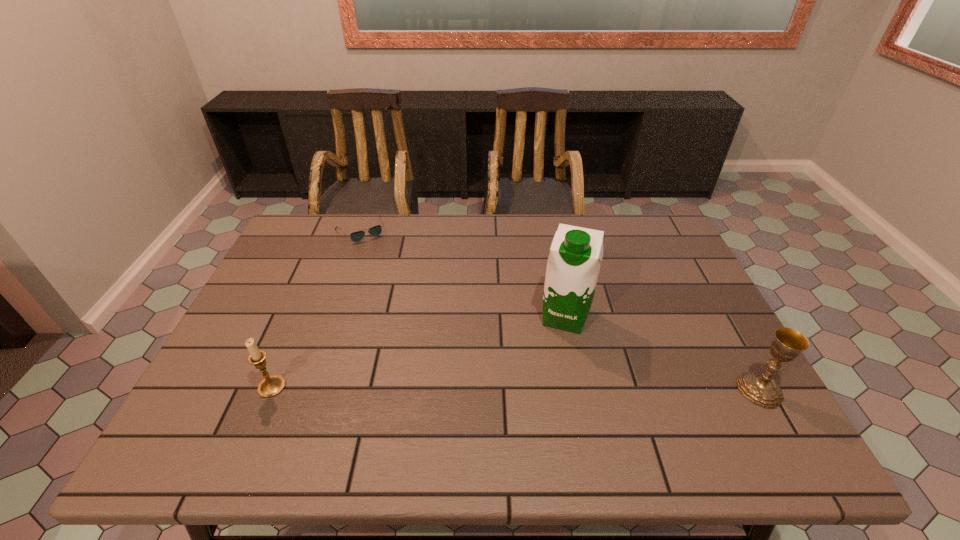
You are a GUI agent. You are given a task and a screenshot of the screen. Output one action in this format:
    pyautogui.click(x=<x>, y=<y>)
    Task: Click on the candle holder
    
    Given the screenshot: What is the action you would take?
    point(270,386)

At what (x,y) coordinates should I click in order to perform the action: click on the rightmost object. Please return your answer as a coordinate pair (x, y). Looking at the image, I should click on (760, 388).

Where is `the tallest object`? The width and height of the screenshot is (960, 540). the tallest object is located at coordinates (576, 253).

Image resolution: width=960 pixels, height=540 pixels. I want to click on the third nearest object, so click(x=576, y=253).

Locate an element on the screen. the farthest object is located at coordinates (357, 236).

Identify the location of the shortest object. The width and height of the screenshot is (960, 540). (357, 236).

Image resolution: width=960 pixels, height=540 pixels. Identify the location of free spot located 0.090m on the right of the candle holder. (324, 387).

Where is `vacant region located 0.330m on the back of the rightmost object`? vacant region located 0.330m on the back of the rightmost object is located at coordinates (697, 279).

The width and height of the screenshot is (960, 540). I want to click on vacant space located on the front-facing side of the soya milk, so click(547, 382).

Find the location of a particular element. The height and width of the screenshot is (540, 960). vacant space located 0.170m on the front-facing side of the soya milk is located at coordinates (545, 389).